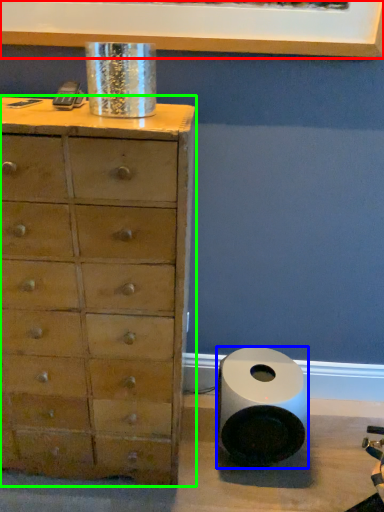
Question: Considering the real-world distances, which object is farthest from picture frame (highlighted by a red box)? speaker (highlighted by a blue box) or chest of drawers (highlighted by a green box)?

Choices:
 (A) speaker
 (B) chest of drawers

Answer: (A)